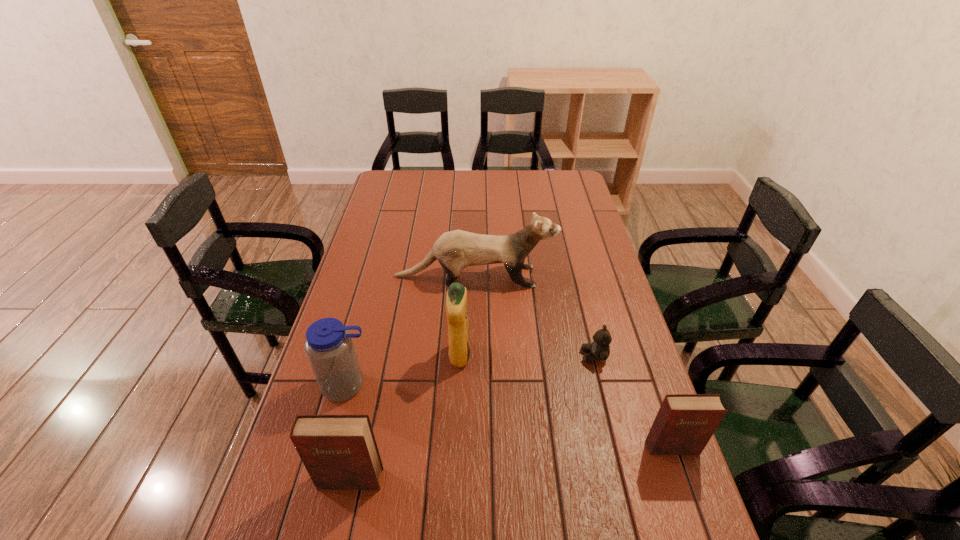
You are a GUI agent. You are given a task and a screenshot of the screen. Output one action in this format:
    pyautogui.click(x=<x>, y=<y>)
    Task: Click on the diary present at the right edge
    The width and height of the screenshot is (960, 540).
    Given the screenshot: What is the action you would take?
    pyautogui.click(x=684, y=424)

Image resolution: width=960 pixels, height=540 pixels. I want to click on teddy bear positioned at the right edge, so click(x=600, y=349).

I want to click on vacant space at the far edge, so click(531, 171).

The width and height of the screenshot is (960, 540). I want to click on vacant space at the left edge of the desktop, so click(379, 217).

In the image, there is a desktop. Identify the location of free space at the right edge. The width and height of the screenshot is (960, 540). (608, 283).

Identify the location of free space at the far left corner. (393, 186).

The width and height of the screenshot is (960, 540). I want to click on free space between the water bottle and the ferret, so click(x=411, y=331).

The height and width of the screenshot is (540, 960). In order to click on vacant region between the second object from right to left and the ferret in this screenshot , I will do `click(535, 316)`.

Find the location of a particular element. Image resolution: width=960 pixels, height=540 pixels. free space between the teddy bear and the taller diary is located at coordinates (472, 417).

Where is `free point between the water bottle and the farthest object`? The image size is (960, 540). free point between the water bottle and the farthest object is located at coordinates (411, 331).